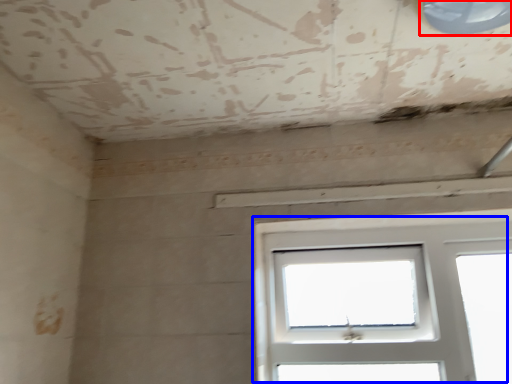
Question: Which object is closer to the camera taking this photo, window (highlighted by a red box) or window (highlighted by a blue box)?

Choices:
 (A) window
 (B) window

Answer: (A)